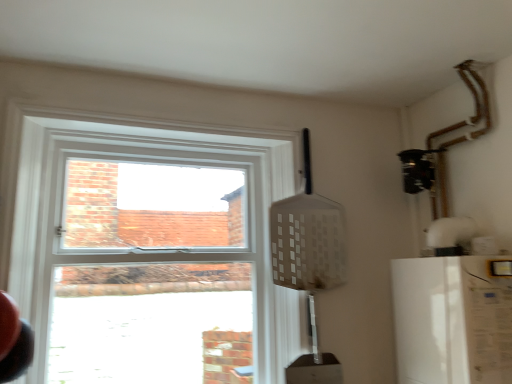
Question: Relative to white matte refrigerator at right, is clear glass window at upper left in front or behind?

Choices:
 (A) behind
 (B) front

Answer: (A)

Question: Is clear glass window at upper left bigger or smaller than white matte refrigerator at right?

Choices:
 (A) big
 (B) small

Answer: (A)

Question: Does point (69, 140) appear closer or farther from the camera than point (449, 354)?

Choices:
 (A) closer
 (B) farther

Answer: (B)

Question: Is white matte refrigerator at right inside or outside of clear glass window at upper left?

Choices:
 (A) inside
 (B) outside

Answer: (B)

Question: Considering the positions of white matte refrigerator at right and clear glass window at upper left in the image, is white matte refrigerator at right taller or shorter than clear glass window at upper left?

Choices:
 (A) short
 (B) tall

Answer: (A)

Question: Does point (394, 291) appear closer or farther from the camera than point (190, 286)?

Choices:
 (A) farther
 (B) closer

Answer: (B)

Question: Is white matte refrigerator at right bigger or smaller than clear glass window at upper left?

Choices:
 (A) big
 (B) small

Answer: (B)